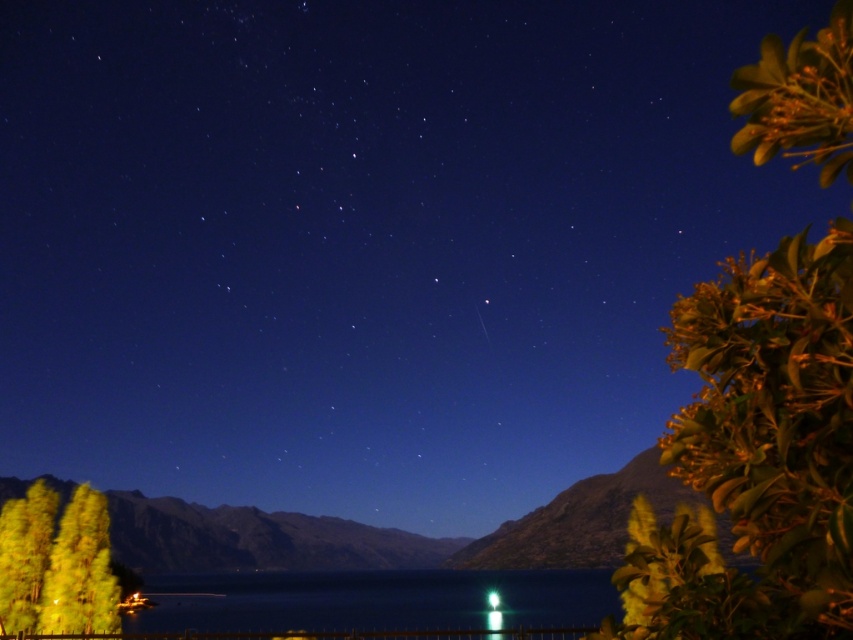
Question: Which point is closer to the camera?

Choices:
 (A) green glossy leaves at upper right
 (B) green translucent light at lower center
 (C) shiny blue water at center

Answer: (A)

Question: Is green glossy leaves at upper right bigger than shiny blue water at center?

Choices:
 (A) no
 (B) yes

Answer: (A)

Question: Which point is farther to the camera?

Choices:
 (A) green translucent light at lower center
 (B) shiny blue water at center

Answer: (A)

Question: Considering the relative positions of green glossy leaves at upper right and shiny blue water at center in the image provided, where is green glossy leaves at upper right located with respect to shiny blue water at center?

Choices:
 (A) below
 (B) above

Answer: (B)

Question: Which of the following is the closest to the observer?

Choices:
 (A) shiny yellow leaves at lower left
 (B) shiny blue water at center
 (C) green glossy leaves at upper right

Answer: (C)

Question: Is shiny yellow leaves at lower left bigger than green translucent light at lower center?

Choices:
 (A) yes
 (B) no

Answer: (A)